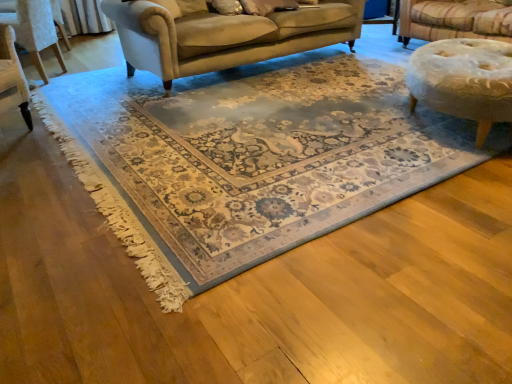
Where is `velvet upholstered chair at upper left`? velvet upholstered chair at upper left is located at coordinates (34, 31).

What do you see at coordinates (34, 31) in the screenshot? This screenshot has height=384, width=512. I see `velvet upholstered chair at upper left` at bounding box center [34, 31].

What is the approximate width of velvet upholstered chair at upper left?

The width of velvet upholstered chair at upper left is 24.72 inches.

I want to click on beige wool rug at center, so click(x=250, y=159).

What do you see at coordinates (250, 159) in the screenshot? The image size is (512, 384). I see `beige wool rug at center` at bounding box center [250, 159].

Identify the location of velvet upholstered chair at upper left. The width and height of the screenshot is (512, 384). (34, 31).

Visually, is beige wool rug at center positioned to the left or to the right of velvet upholstered chair at upper left?

In the image, beige wool rug at center appears on the right side of velvet upholstered chair at upper left.

Considering the positions of objects beige wool rug at center and velvet upholstered chair at upper left in the image provided, who is in front, beige wool rug at center or velvet upholstered chair at upper left?

beige wool rug at center.

Is point (275, 95) positioned behind point (45, 27)?

No, (275, 95) is in front of (45, 27).

From the image's perspective, between beige wool rug at center and velvet upholstered chair at upper left, who is located below?

From the image's view, beige wool rug at center is below.

From a real-world perspective, between beige wool rug at center and velvet upholstered chair at upper left, who is vertically higher?

velvet upholstered chair at upper left.

Which object is thinner, beige wool rug at center or velvet upholstered chair at upper left?

With smaller width is velvet upholstered chair at upper left.

Considering the relative sizes of beige wool rug at center and velvet upholstered chair at upper left in the image provided, is beige wool rug at center taller than velvet upholstered chair at upper left?

In fact, beige wool rug at center may be shorter than velvet upholstered chair at upper left.

Can you confirm if beige wool rug at center is smaller than velvet upholstered chair at upper left?

Incorrect, beige wool rug at center is not smaller in size than velvet upholstered chair at upper left.

Is beige wool rug at center inside or outside of velvet upholstered chair at upper left?

beige wool rug at center lies outside velvet upholstered chair at upper left.

Does beige wool rug at center touch velvet upholstered chair at upper left?

No, beige wool rug at center is not in contact with velvet upholstered chair at upper left.

Is velvet upholstered chair at upper left at the back of beige wool rug at center?

beige wool rug at center is not turned away from velvet upholstered chair at upper left.

How many degrees apart are the facing directions of beige wool rug at center and velvet upholstered chair at upper left?

The angular difference between beige wool rug at center and velvet upholstered chair at upper left is 144 degrees.

This screenshot has width=512, height=384. In order to click on chair on the left of the beige wool rug at center in this screenshot , I will do `click(34, 31)`.

Considering the positions of objects velvet upholstered chair at upper left and beige wool rug at center in the image provided, who is more to the right, velvet upholstered chair at upper left or beige wool rug at center?

Positioned to the right is beige wool rug at center.

Is the position of velvet upholstered chair at upper left more distant than that of beige wool rug at center?

Yes, velvet upholstered chair at upper left is behind beige wool rug at center.

Is point (45, 47) farther from camera compared to point (212, 143)?

Yes, it is.

From the image's perspective, which one is positioned lower, velvet upholstered chair at upper left or beige wool rug at center?

From the image's view, beige wool rug at center is below.

From a real-world perspective, is velvet upholstered chair at upper left above or below beige wool rug at center?

velvet upholstered chair at upper left is above beige wool rug at center.

Is velvet upholstered chair at upper left wider than beige wool rug at center?

In fact, velvet upholstered chair at upper left might be narrower than beige wool rug at center.

Is velvet upholstered chair at upper left taller or shorter than beige wool rug at center?

velvet upholstered chair at upper left is taller than beige wool rug at center.

Can you confirm if velvet upholstered chair at upper left is smaller than beige wool rug at center?

Yes, velvet upholstered chair at upper left is smaller than beige wool rug at center.

Is velvet upholstered chair at upper left located outside beige wool rug at center?

velvet upholstered chair at upper left lies outside beige wool rug at center's area.

Is velvet upholstered chair at upper left beside beige wool rug at center?

No, velvet upholstered chair at upper left is not in contact with beige wool rug at center.

Is velvet upholstered chair at upper left facing away from beige wool rug at center?

Yes, velvet upholstered chair at upper left is positioned with its back facing beige wool rug at center.

How many degrees apart are the facing directions of velvet upholstered chair at upper left and beige wool rug at center?

144 degrees.

I want to click on mat in front of the velvet upholstered chair at upper left, so click(250, 159).

What are the coordinates of `chair on the left of beige wool rug at center` in the screenshot? It's located at click(34, 31).

Locate an element on the screen. The image size is (512, 384). mat that is in front of the velvet upholstered chair at upper left is located at coordinates (250, 159).